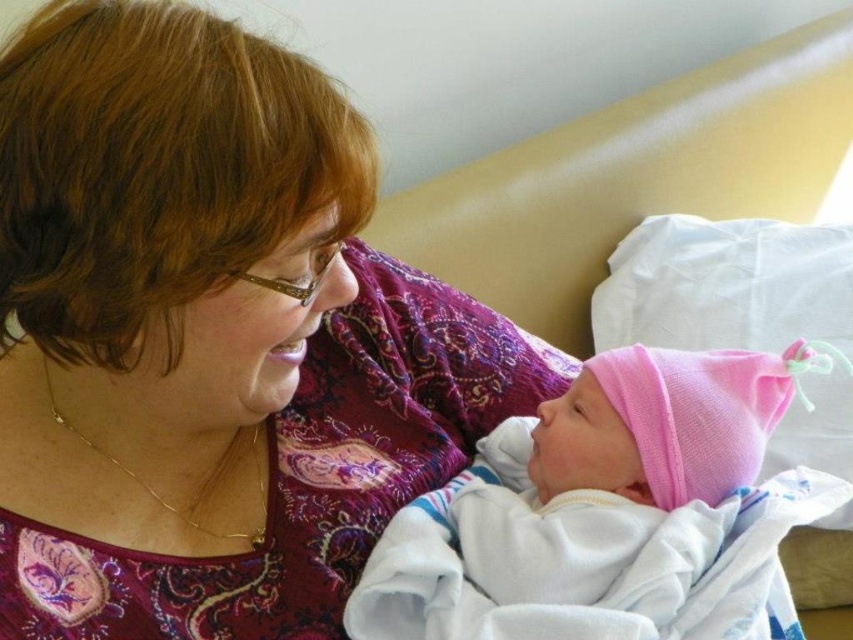
Does matte purple blouse at center appear on the right side of pink fabric hat at center?

In fact, matte purple blouse at center is to the left of pink fabric hat at center.

Does point (263, 547) come closer to viewer compared to point (544, 563)?

No, it is behind (544, 563).

Which is in front, point (283, 380) or point (357, 598)?

Point (283, 380)

Locate an element on the screen. matte purple blouse at center is located at coordinates (210, 337).